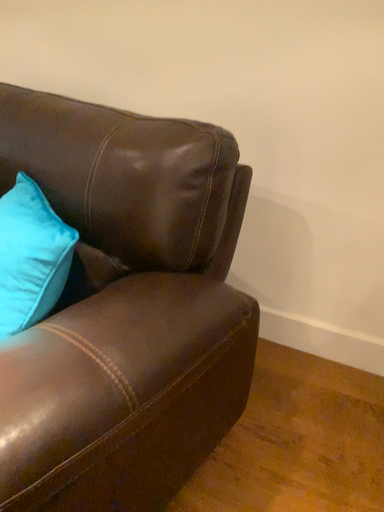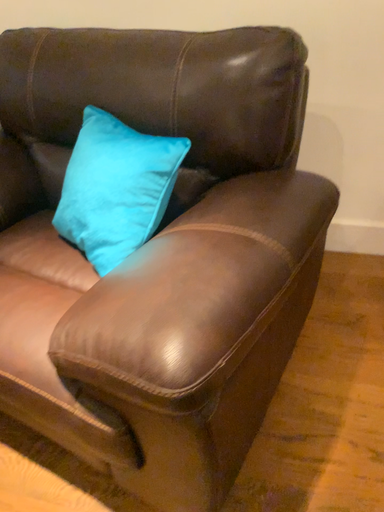
Question: How did the camera likely rotate when shooting the video?

Choices:
 (A) rotated left
 (B) rotated right

Answer: (B)